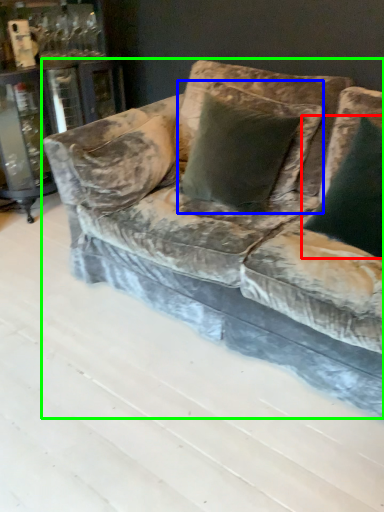
Question: Which is nearer to the pillow (highlighted by a red box)? pillow (highlighted by a blue box) or studio couch (highlighted by a green box).

Choices:
 (A) pillow
 (B) studio couch

Answer: (A)